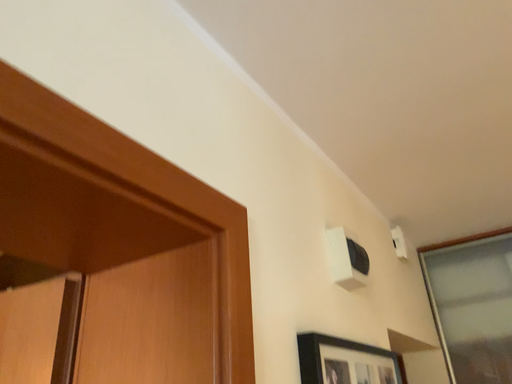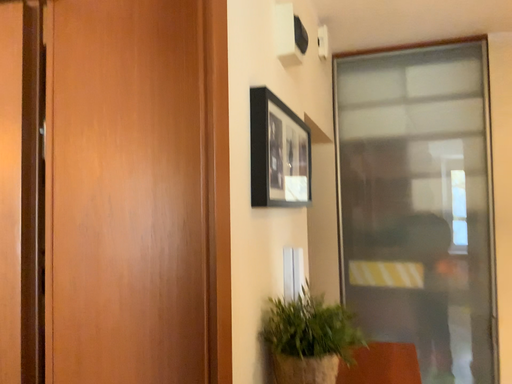
Question: Which way did the camera rotate in the video?

Choices:
 (A) rotated right
 (B) rotated left

Answer: (A)